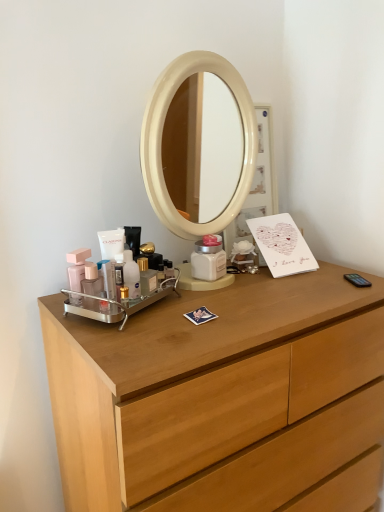
The image size is (384, 512). What are the coordinates of `free spot to the right of matte pink bottle at left, the second toiletry from the left` in the screenshot? It's located at (162, 314).